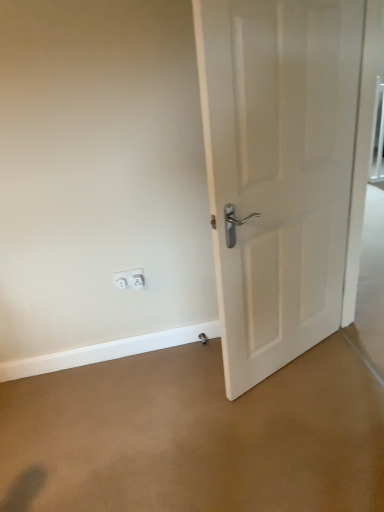
This screenshot has height=512, width=384. I want to click on empty space that is ontop of brown carpet at center (from a real-world perspective), so coord(208,426).